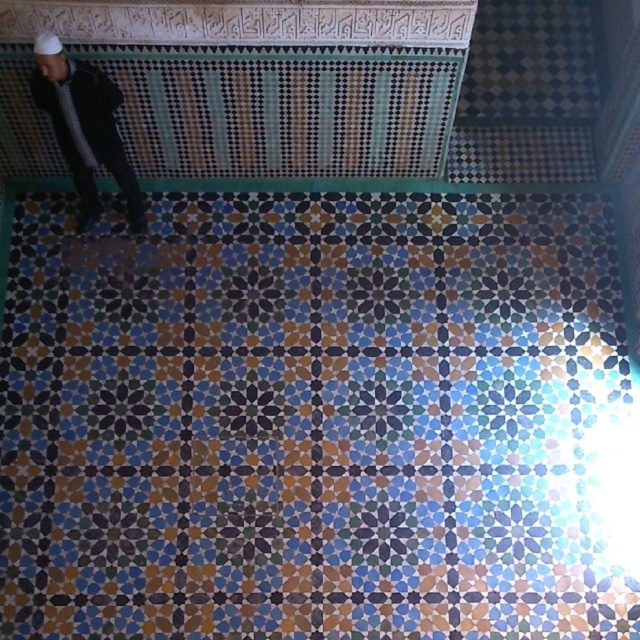
You are standing in a room with a tiled floor and wall. You see a mosaic tile at center and a dark gray jacket at left. Which object is closer to the floor?

The mosaic tile at center is closer to the floor because it is located below the dark gray jacket at left.

You are standing in a room with a beautiful tiled floor and wall. You notice a mosaic tile at center and a dark gray jacket at left. Which object is closer to you?

The mosaic tile at center is closer to you than the dark gray jacket at left.